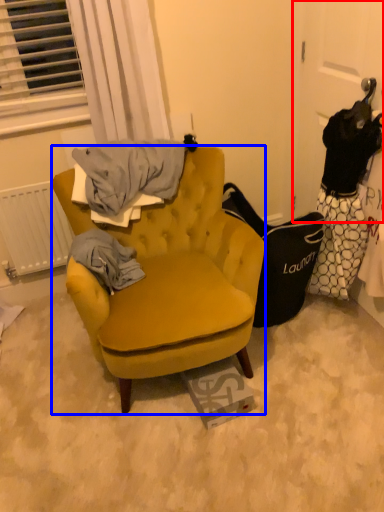
Question: Which point is closer to the camera, door (highlighted by a red box) or chair (highlighted by a blue box)?

Choices:
 (A) door
 (B) chair

Answer: (B)